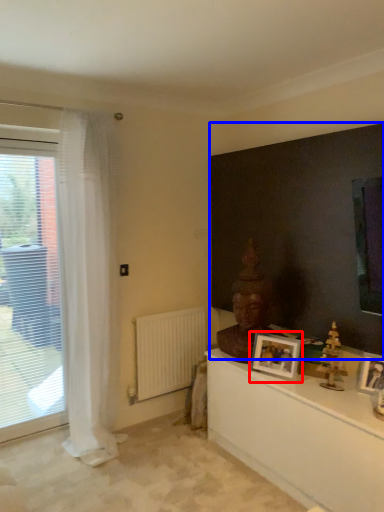
Question: Which point is further to the camera, picture frame (highlighted by a red box) or backdrop (highlighted by a blue box)?

Choices:
 (A) picture frame
 (B) backdrop

Answer: (A)